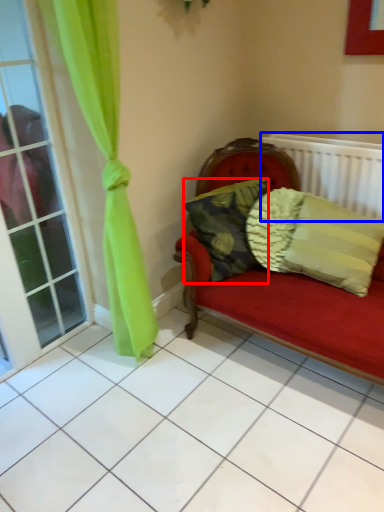
Question: Which object appears farthest to the camera in this image, pillow (highlighted by a red box) or radiator (highlighted by a blue box)?

Choices:
 (A) pillow
 (B) radiator

Answer: (B)